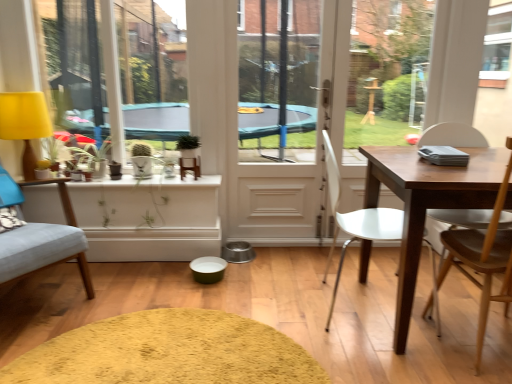
Find the location of a particular element. vacant space behind white plastic chair at center, the 2th chair when ordered from right to left is located at coordinates (328, 260).